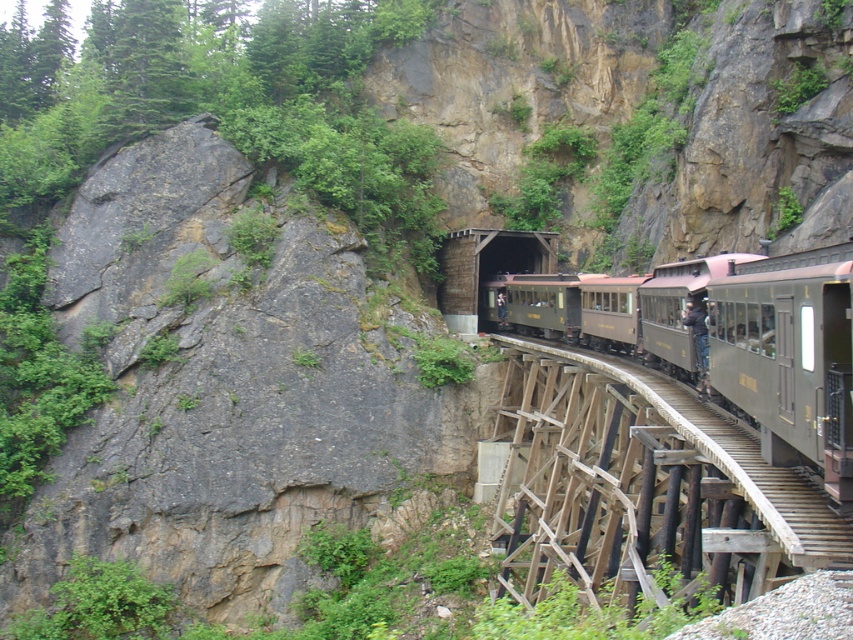
You are a passenger on the matte black train car at center and want to see the green wooden bridge at center from your current position. Is the bridge above or below you?

The matte black train car at center is positioned under the green wooden bridge at center, so the bridge is above you.

You are standing at the camera position observing the scenic railway scene. There is a specific point marked at coordinates point (689, 524). If you want to place a safety barrier 10 meters away from your current position towards that point, will the barrier be closer to you or to the point?

The point (689, 524) is 13.88 meters away from the camera. Placing a safety barrier 10 meters towards the point would mean the barrier is closer to you than the point. Specifically, the distance from you to the barrier is 10 meters, while the remaining distance from the barrier to the point is 3.88 meters. Therefore, the barrier will be closer to you.